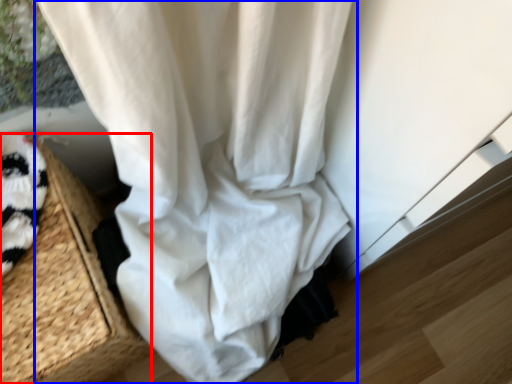
Question: Which of the following is the farthest to the observer, basket (highlighted by a red box) or curtain (highlighted by a blue box)?

Choices:
 (A) basket
 (B) curtain

Answer: (B)